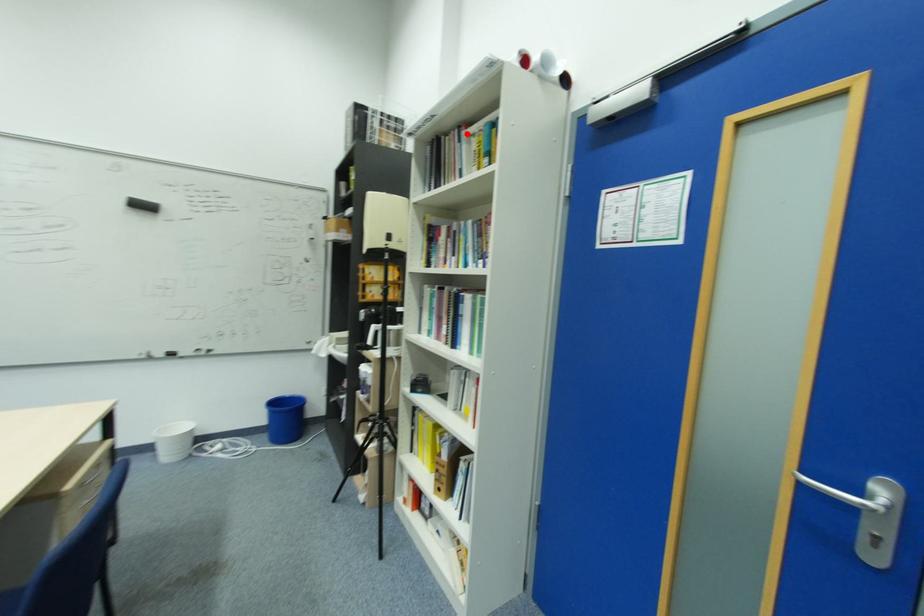
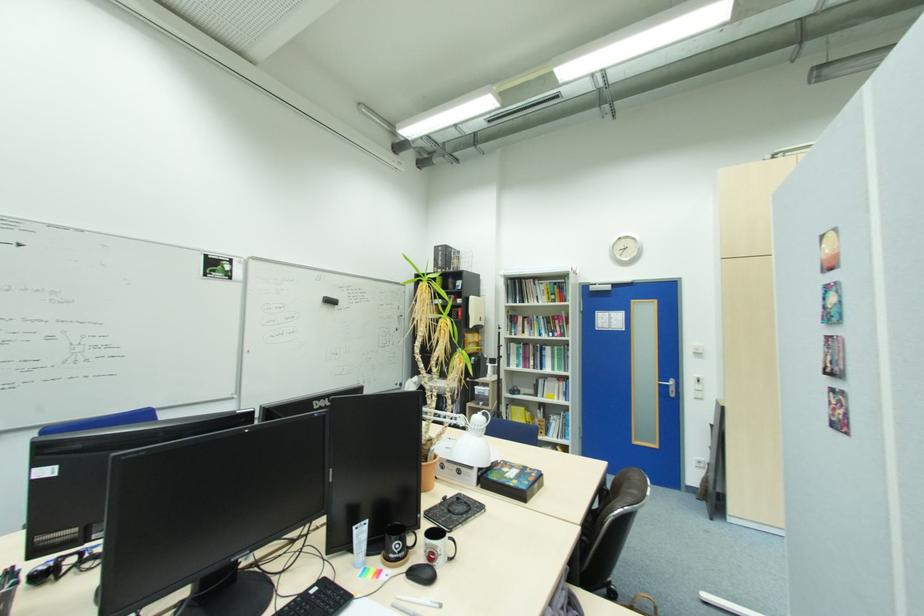
Question: I am providing you with two images of the same scene from different viewpoints. A red point is marked on the first image. Can you still see the location of the red point in image 2?

Choices:
 (A) Yes
 (B) No

Answer: (A)